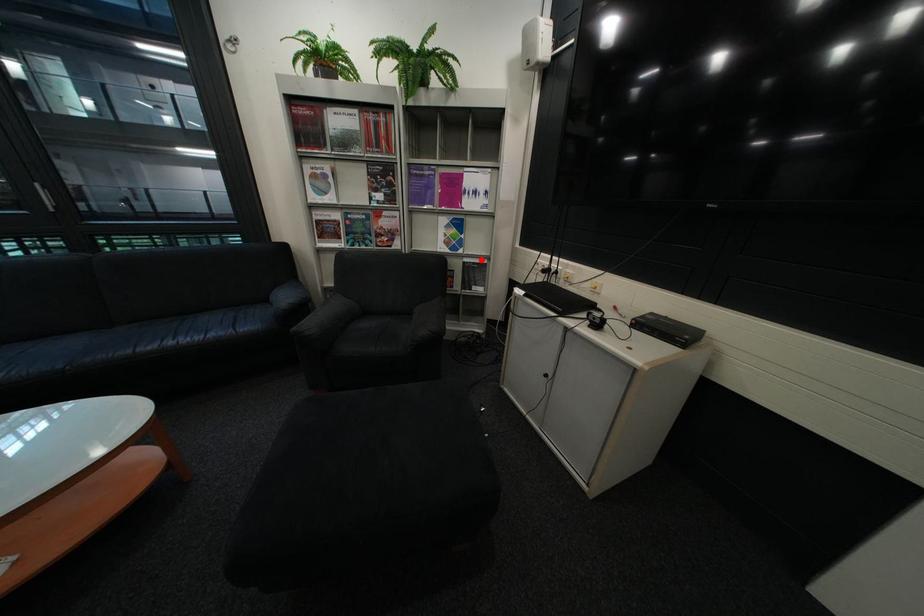
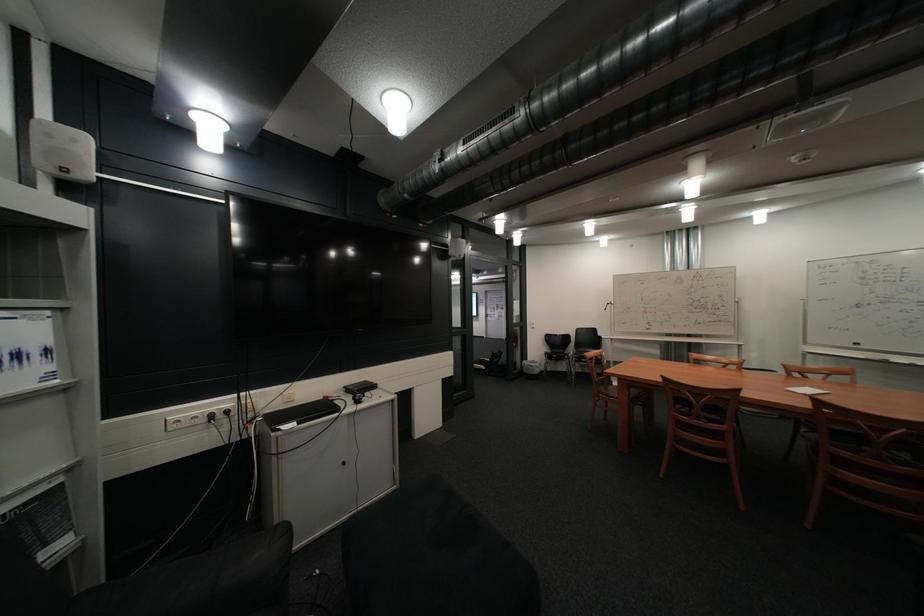
Question: I am providing you with two images of the same scene from different viewpoints. Image1 has a red point marked. In image2, the corresponding 3D location appears at what relative position? Reply with the corresponding letter.

Choices:
 (A) Closer
 (B) Farther

Answer: (B)